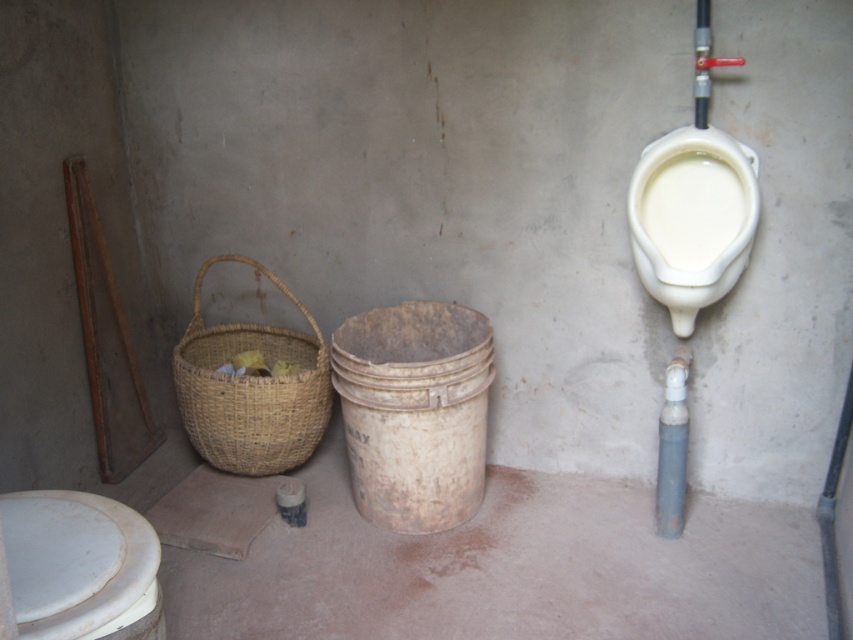
You are standing in the restroom and need to use either the white glossy toilet bowl at lower left or the white glossy urinal at upper right. Which one is closer to your current position if you are facing the wall where both are mounted?

The white glossy toilet bowl at lower left is closer to your current position because it is to the left of the white glossy urinal at upper right, meaning it is positioned nearer when facing the wall.

You are a maintenance worker needing to clean both the white glossy toilet bowl at lower left and the white glossy urinal at upper right. If your cleaning spray can reach up to 1.5 meters, can you clean both fixtures from your current position without moving closer?

The distance between the white glossy toilet bowl at lower left and the white glossy urinal at upper right is 1.49 meters, so yes, the spray can reach both fixtures from your current position since 1.49 meters is within the 1.5 meter range.

You are a maintenance worker inspecting the restroom. You need to move the white glossy urinal at upper right to the left side of the woven straw basket at lower left. Is this possible without moving the basket?

The woven straw basket at lower left is already to the left of the white glossy urinal at upper right, so moving the urinal to the left of the basket would require moving it in the opposite direction. This is not possible without moving the basket first.